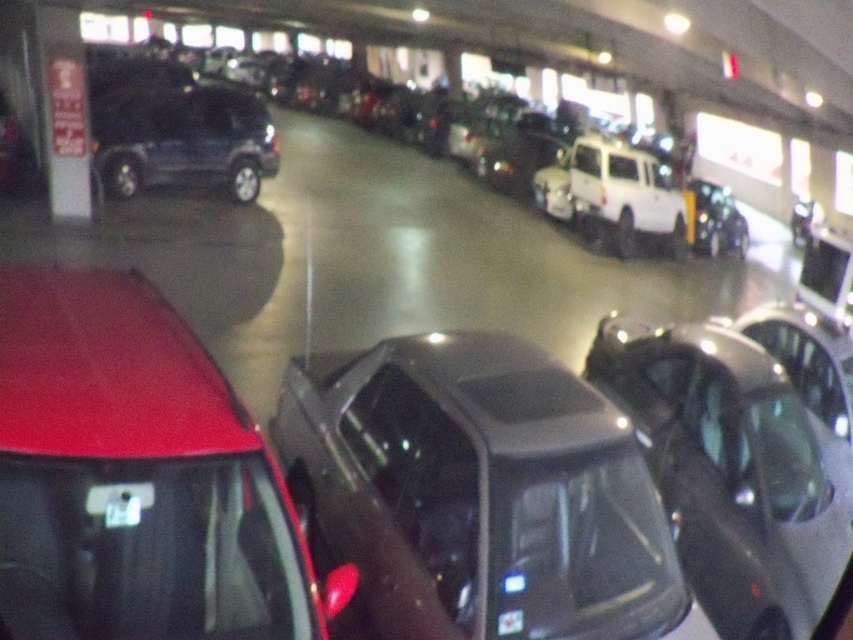
You are a delivery person trying to park your 1.8 meters tall delivery box in the parking garage. You see the matte black car at center and the shiny red car at lower left. Can you place your delivery box between them vertically?

The matte black car at center is taller than the shiny red car at lower left. Since your delivery box is 1.8 meters tall, you need to ensure there is enough vertical space between them. However, the height difference between the two cars isn not specified, so it is uncertain if the space between them can accommodate the delivery box.

You are driving a vehicle and want to exit the parking garage. You see the shiny red car at lower left and the matte black suv at center. Which vehicle should you avoid hitting if you move forward?

You should avoid hitting the shiny red car at lower left because it is closer to you than the matte black suv at center.

What is the color of the car located at the coordinates point (x=474, y=493) in the parking garage?

The point (x=474, y=493) indicates a matte black car at center, so the car at those coordinates is matte black.